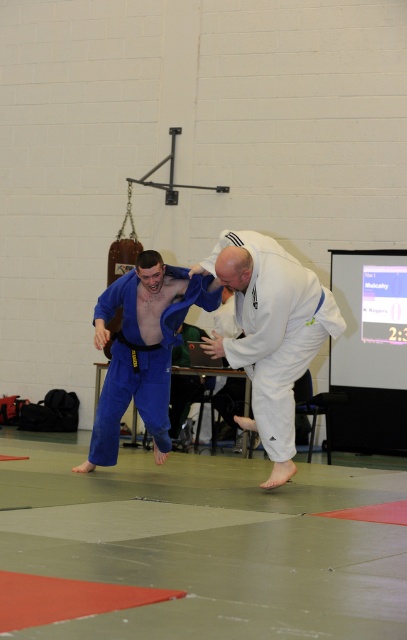
Question: Does white matte kimono at center appear on the left side of blue fabric at center?

Choices:
 (A) no
 (B) yes

Answer: (A)

Question: Is white matte kimono at center bigger than blue fabric at center?

Choices:
 (A) yes
 (B) no

Answer: (B)

Question: Which object appears closest to the camera in this image?

Choices:
 (A) blue fabric at center
 (B) white matte kimono at center

Answer: (B)

Question: Where is white matte kimono at center located in relation to blue fabric at center in the image?

Choices:
 (A) right
 (B) left

Answer: (A)

Question: Among these points, which one is nearest to the camera?

Choices:
 (A) (280, 289)
 (B) (124, 371)

Answer: (A)